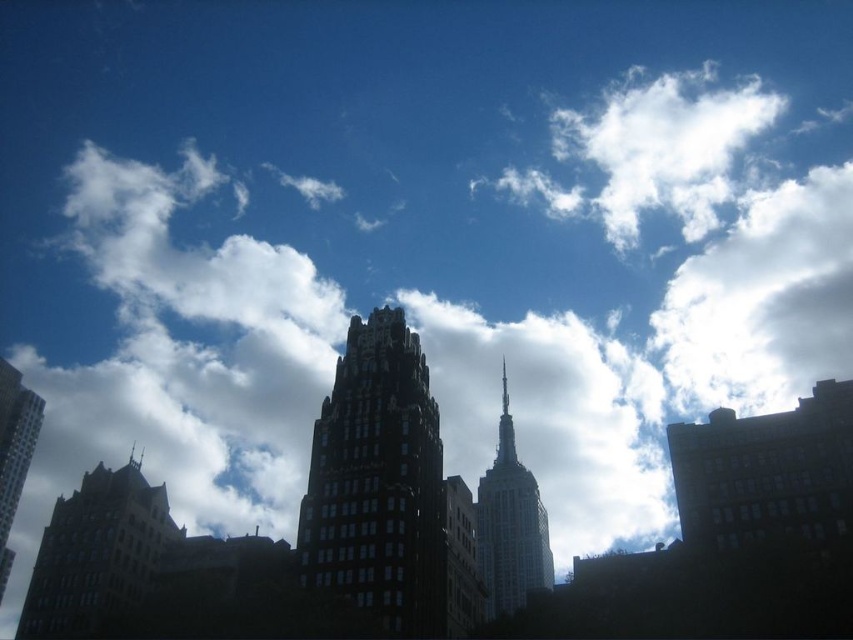
Question: Where is dark glass skyscraper at center located in relation to dark gray stone tower at lower left in the image?

Choices:
 (A) left
 (B) right

Answer: (B)

Question: Estimate the real-world distances between objects in this image. Which object is closer to the white fluffy cloud at upper center?

Choices:
 (A) white glass tower at center
 (B) dark gray stone tower at lower left
 (C) dark glass skyscraper at left
 (D) dark glass skyscraper at center

Answer: (A)

Question: Estimate the real-world distances between objects in this image. Which object is farther from the dark glass skyscraper at center?

Choices:
 (A) white glass tower at center
 (B) white fluffy cloud at upper center

Answer: (B)

Question: Among these points, which one is farthest from the camera?

Choices:
 (A) (12, 419)
 (B) (503, 369)

Answer: (B)

Question: Does dark glass skyscraper at center have a lesser width compared to white fluffy cloud at upper center?

Choices:
 (A) no
 (B) yes

Answer: (B)

Question: Is white fluffy cloud at upper center thinner than dark glass skyscraper at left?

Choices:
 (A) yes
 (B) no

Answer: (B)